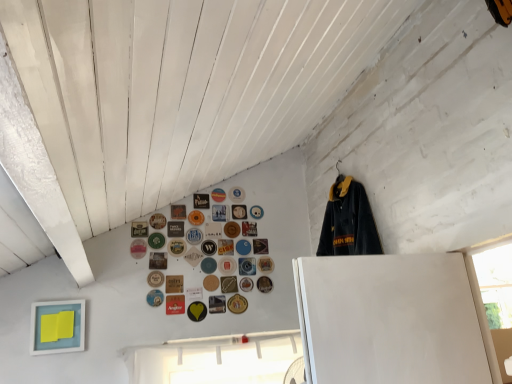
Question: Which direction should I rotate to look at gold metallic button at center, which ranks as the 29th button in left-to-right order?

Choices:
 (A) left
 (B) right

Answer: (A)

Question: From a real-world perspective, does matte yellow button at center, the 23th button viewed from the right, sit lower than metallic gold button at upper center, the tenth button viewed from the left?

Choices:
 (A) yes
 (B) no

Answer: (A)

Question: From the image's perspective, is matte yellow button at center, the 15th button in the left-to-right sequence, under metallic gold button at upper center, placed as the 28th button when sorted from right to left?

Choices:
 (A) yes
 (B) no

Answer: (A)

Question: Does matte yellow button at center, the 15th button in the left-to-right sequence, appear on the left side of metallic gold button at upper center, the tenth button viewed from the left?

Choices:
 (A) no
 (B) yes

Answer: (A)

Question: Does matte yellow button at center, the 23th button viewed from the right, have a smaller size compared to metallic gold button at upper center, placed as the 28th button when sorted from right to left?

Choices:
 (A) yes
 (B) no

Answer: (A)

Question: Does matte yellow button at center, the 15th button in the left-to-right sequence, contain metallic gold button at upper center, the tenth button viewed from the left?

Choices:
 (A) no
 (B) yes

Answer: (A)

Question: Is matte yellow button at center, the 23th button viewed from the right, looking in the opposite direction of metallic gold button at upper center, the tenth button viewed from the left?

Choices:
 (A) yes
 (B) no

Answer: (B)

Question: Is orange matte button at upper center, which is counted as the fourteenth button, starting from the left, far from matte yellow button at center, the 23th button viewed from the right?

Choices:
 (A) no
 (B) yes

Answer: (A)

Question: Does orange matte button at upper center, which is counted as the 24th button, starting from the right, have a greater width compared to matte yellow button at center, the 23th button viewed from the right?

Choices:
 (A) no
 (B) yes

Answer: (B)

Question: Is orange matte button at upper center, which is counted as the 24th button, starting from the right, thinner than matte yellow button at center, the 15th button in the left-to-right sequence?

Choices:
 (A) yes
 (B) no

Answer: (B)

Question: Does orange matte button at upper center, which is counted as the 24th button, starting from the right, turn towards matte yellow button at center, the 23th button viewed from the right?

Choices:
 (A) yes
 (B) no

Answer: (B)

Question: Does orange matte button at upper center, which is counted as the fourteenth button, starting from the left, lie behind matte yellow button at center, the 23th button viewed from the right?

Choices:
 (A) no
 (B) yes

Answer: (B)

Question: From a real-world perspective, is orange matte button at upper center, which is counted as the 24th button, starting from the right, under matte yellow button at center, the 23th button viewed from the right?

Choices:
 (A) no
 (B) yes

Answer: (A)

Question: From the image's perspective, is blue fabric button at upper center, acting as the 25th button starting from the right, above metallic gold button at upper center, the 25th button in the left-to-right sequence?

Choices:
 (A) yes
 (B) no

Answer: (A)